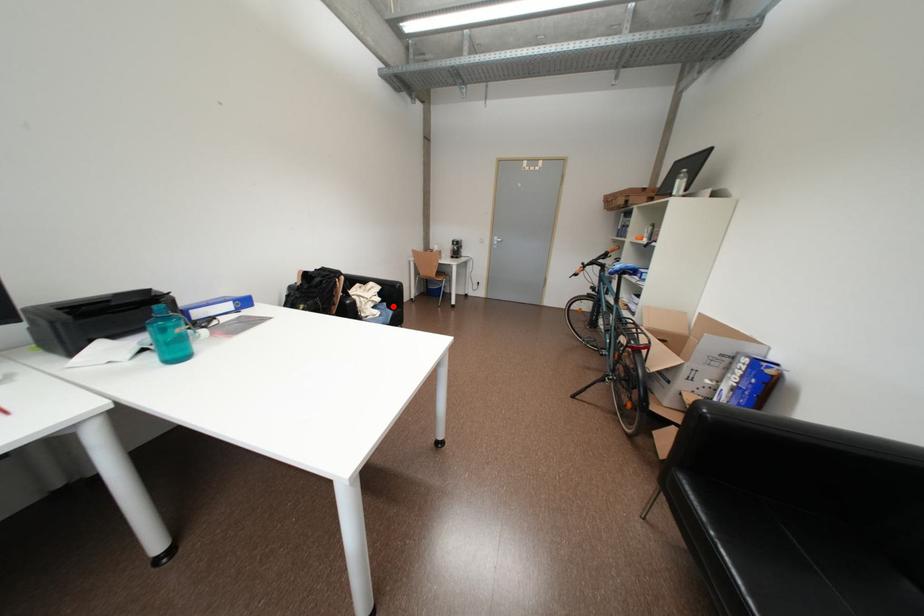
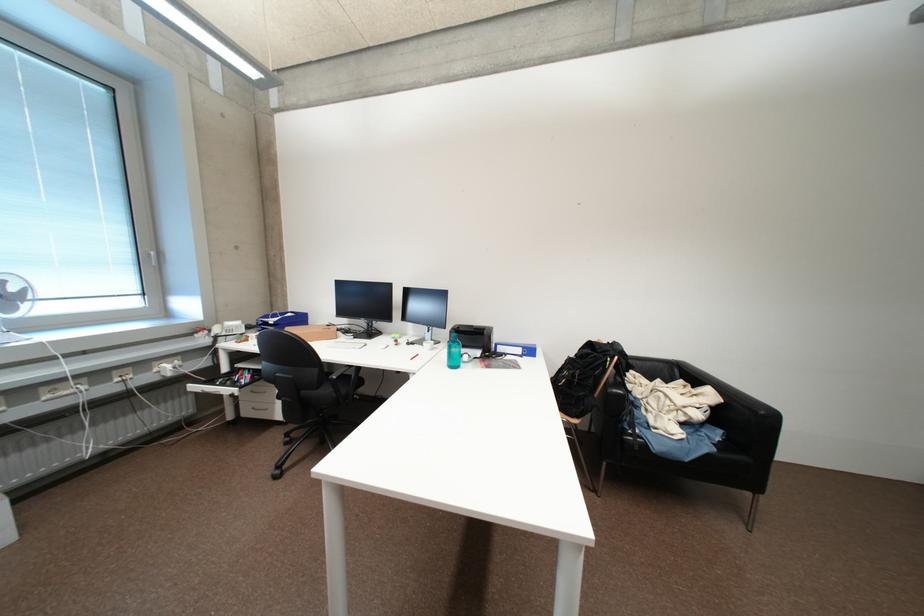
The point at the highlighted location is marked in the first image. Where is the corresponding point in the second image?

(727, 434)